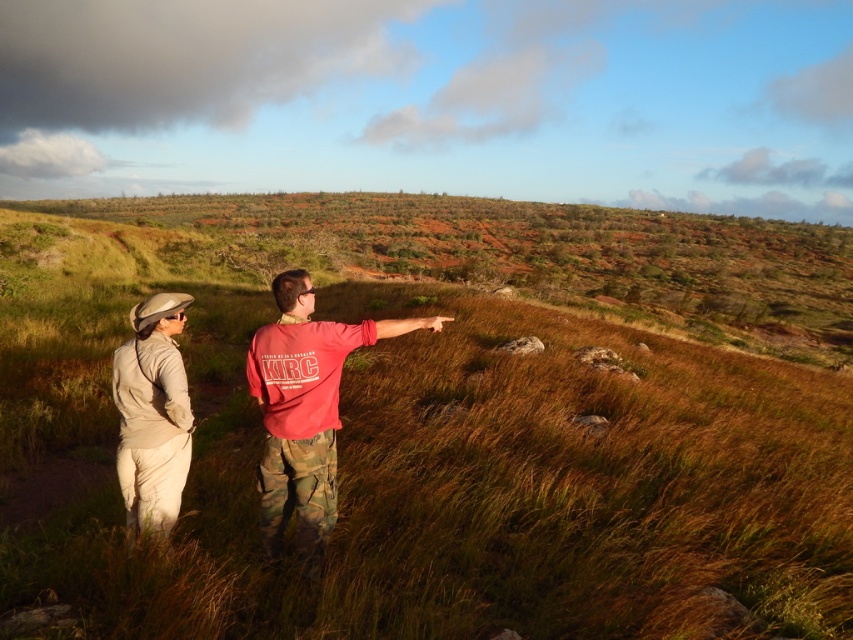
You are a hiker trying to navigate through the brown grass at center and the brown grassy hillside at center. Which area would be easier to walk through based on their heights?

The brown grass at center has a lesser height compared to the brown grassy hillside at center, so it would be easier to walk through the brown grass at center.